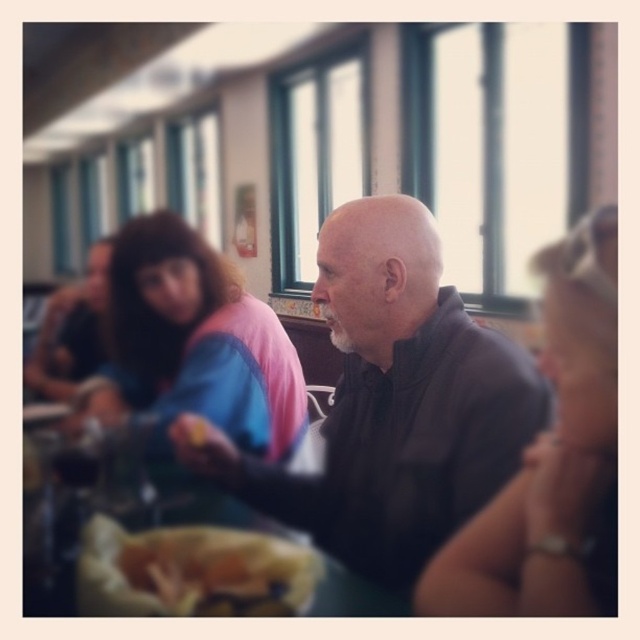
Which is above, matte black shirt at center or brown wood table at center?

matte black shirt at center is higher up.

In the scene shown: Is matte black shirt at center thinner than brown wood table at center?

Correct, matte black shirt at center's width is less than brown wood table at center's.

Looking at this image, measure the distance between point (593,460) and camera.

They are 28.02 inches apart.

Find the location of a particular element. The image size is (640, 640). matte black shirt at center is located at coordinates (552, 461).

Is golden crispy bread at center taller than brown wood table at center?

Incorrect, golden crispy bread at center's height is not larger of brown wood table at center's.

Is golden crispy bread at center shorter than brown wood table at center?

Yes, golden crispy bread at center is shorter than brown wood table at center.

Which is in front, point (307, 579) or point (333, 589)?

Positioned in front is point (307, 579).

The width and height of the screenshot is (640, 640). I want to click on golden crispy bread at center, so click(192, 572).

Who is more distant from viewer, [28,538] or [51,364]?

Positioned behind is point [51,364].

Measure the distance between point (x=125, y=518) and camera.

A distance of 1.23 meters exists between point (x=125, y=518) and camera.

Who is more distant from viewer, (340,568) or (76,353)?

The point (76,353) is more distant.

Locate an element on the screen. Image resolution: width=640 pixels, height=640 pixels. brown wood table at center is located at coordinates (58, 532).